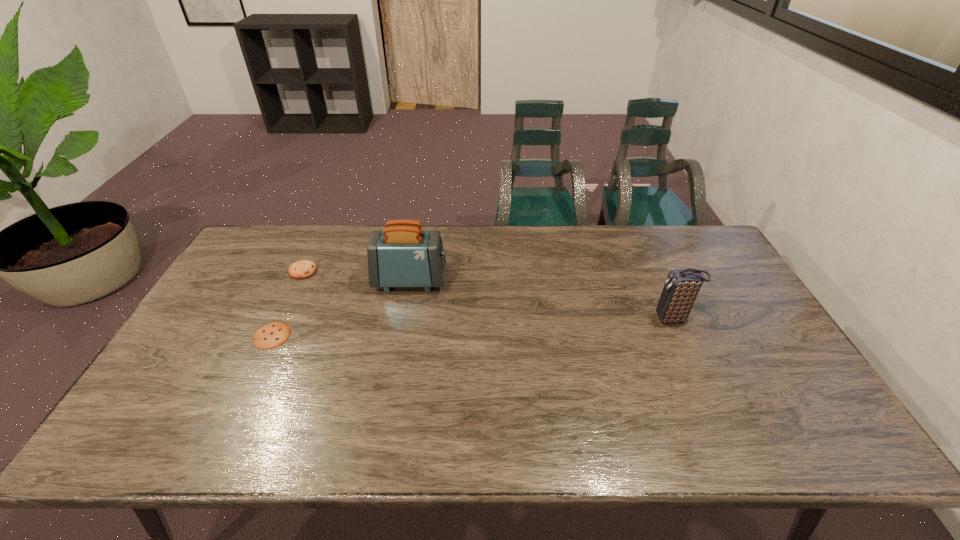
Locate an element on the screen. Image resolution: width=960 pixels, height=540 pixels. free region located with the zip open on the clutch bag is located at coordinates (580, 319).

Where is `vacant space located on the front of the second shortest object`? This screenshot has width=960, height=540. vacant space located on the front of the second shortest object is located at coordinates (265, 351).

The width and height of the screenshot is (960, 540). I want to click on free space located on the back of the nearer cookie, so click(314, 247).

Identify the location of toaster that is at the far edge. (402, 255).

At what (x,y) coordinates should I click in order to perform the action: click on cookie that is at the far edge. Please return your answer as a coordinate pair (x, y). The image size is (960, 540). Looking at the image, I should click on (301, 269).

In the image, there is a desktop. Identify the location of vacant space at the far edge. (612, 241).

I want to click on free region at the near edge of the desktop, so click(401, 440).

At what (x,y) coordinates should I click in order to perform the action: click on free region at the left edge of the desktop. Please return your answer as a coordinate pair (x, y). The image size is (960, 540). Looking at the image, I should click on (205, 357).

The width and height of the screenshot is (960, 540). In the image, there is a desktop. In order to click on vacant space at the far left corner in this screenshot , I will do `click(242, 252)`.

Locate an element on the screen. The width and height of the screenshot is (960, 540). free space at the near right corner of the desktop is located at coordinates (790, 444).